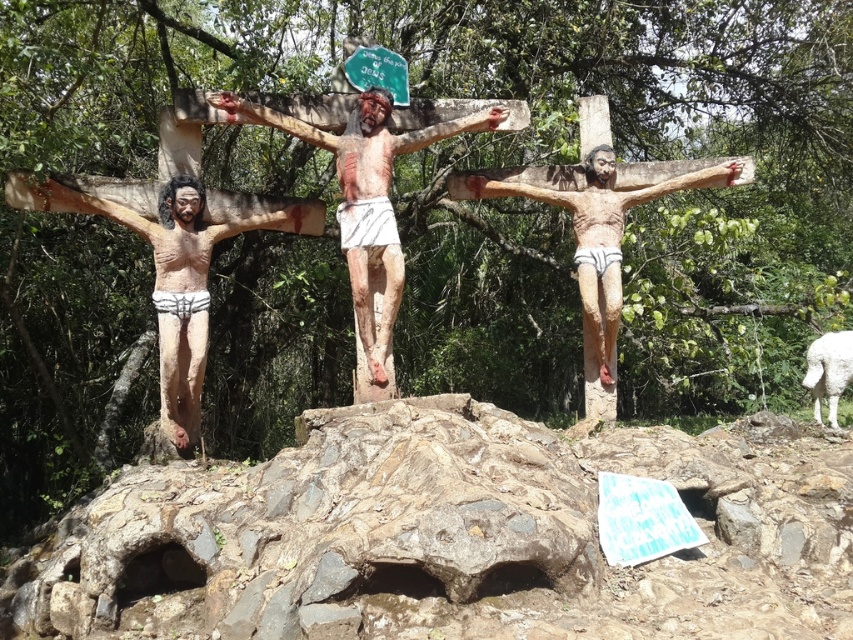
Question: Which object is farther from the camera taking this photo?

Choices:
 (A) matte wood crucifix at left
 (B) white woolen lamb at lower right
 (C) wooden statue at center

Answer: (B)

Question: Which of the following is the closest to the observer?

Choices:
 (A) rough stone at center
 (B) wooden crucifix at center
 (C) wooden statue at center

Answer: (A)

Question: Is matte wood crucifix at left closer to camera compared to wooden statue at center?

Choices:
 (A) no
 (B) yes

Answer: (B)

Question: Among these points, which one is nearest to the camera?

Choices:
 (A) (560, 554)
 (B) (363, 312)
 (C) (845, 362)

Answer: (A)

Question: Can you confirm if rough stone at center is positioned to the left of wooden statue at center?

Choices:
 (A) no
 (B) yes

Answer: (A)

Question: Does rough stone at center have a greater width compared to matte wood crucifix at left?

Choices:
 (A) yes
 (B) no

Answer: (A)